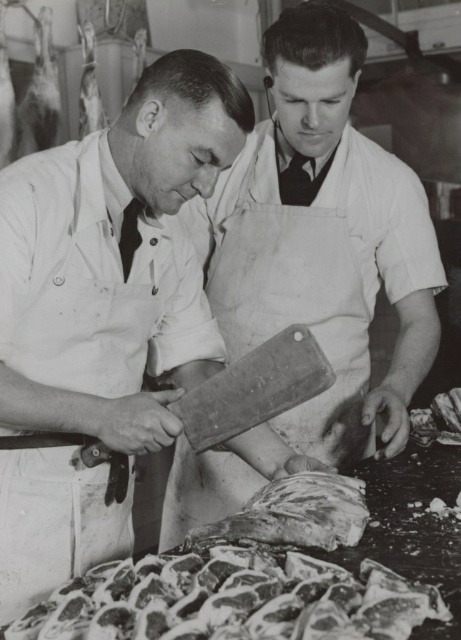
In order to click on smooth white apron at center in this screenshot , I will do `click(104, 312)`.

Does point (177, 420) lie behind point (246, 614)?

Yes, it is behind point (246, 614).

You are a GUI agent. You are given a task and a screenshot of the screen. Output one action in this format:
    pyautogui.click(x=<x>, y=<y>)
    Task: Click on the smooth white apron at center
    
    Given the screenshot: What is the action you would take?
    pyautogui.click(x=104, y=312)

Is smooth wooden cutting board at center bigger than rough textured meat at center?

Yes.

From the picture: Who is shorter, smooth wooden cutting board at center or rough textured meat at center?

Standing shorter between the two is rough textured meat at center.

Which is in front, point (231, 180) or point (335, 515)?

Point (335, 515)

The image size is (461, 640). In order to click on smooth wooden cutting board at center in this screenshot , I will do `click(323, 240)`.

Does point (407, 387) come in front of point (307, 608)?

No, it is behind (307, 608).

The height and width of the screenshot is (640, 461). What do you see at coordinates (323, 240) in the screenshot? I see `smooth wooden cutting board at center` at bounding box center [323, 240].

Locate an element on the screen. This screenshot has width=461, height=640. smooth wooden cutting board at center is located at coordinates (323, 240).